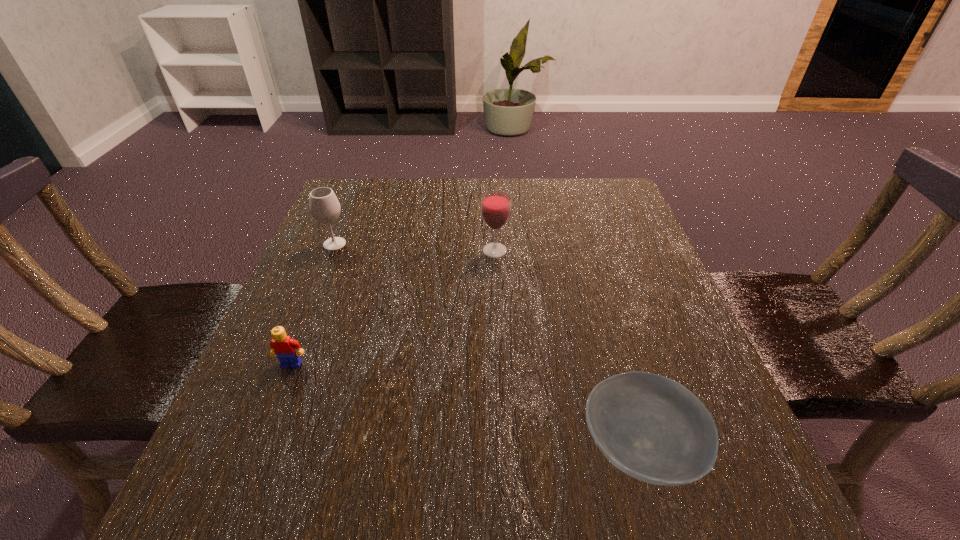
Where is `free space at the far right corner`? free space at the far right corner is located at coordinates (611, 224).

Locate an element on the screen. vacant region at the near right corner of the desktop is located at coordinates (680, 512).

Locate an element on the screen. This screenshot has height=540, width=960. free area in between the left wineglass and the third farthest object is located at coordinates (313, 304).

This screenshot has height=540, width=960. Identify the location of vacant area that lies between the rightmost object and the left wineglass. (487, 346).

I want to click on vacant area that lies between the left wineglass and the right wineglass, so click(415, 247).

You are a GUI agent. You are given a task and a screenshot of the screen. Output one action in this format:
    pyautogui.click(x=<x>, y=<y>)
    Task: Click on the vacant area that lies between the third farthest object and the shortest object
    
    Given the screenshot: What is the action you would take?
    pyautogui.click(x=465, y=406)

This screenshot has height=540, width=960. What are the coordinates of `vacant space that is in between the left wineglass and the rightmost object` in the screenshot? It's located at point(487,346).

Locate an element on the screen. free point between the left wineglass and the rightmost object is located at coordinates (487, 346).

This screenshot has width=960, height=540. Find the location of `free space between the second object from right to left and the left wineglass`. free space between the second object from right to left and the left wineglass is located at coordinates (415, 247).

Find the location of `unoccupied area between the third farthest object and the third object from left to right`. unoccupied area between the third farthest object and the third object from left to right is located at coordinates (394, 307).